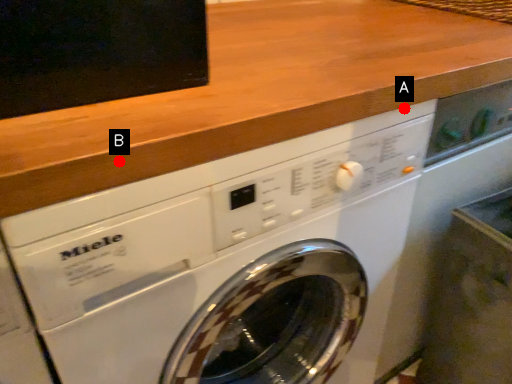
Question: Two points are circled on the image, labeled by A and B beside each circle. Which point is farther to the camera?

Choices:
 (A) A is further
 (B) B is further

Answer: (A)